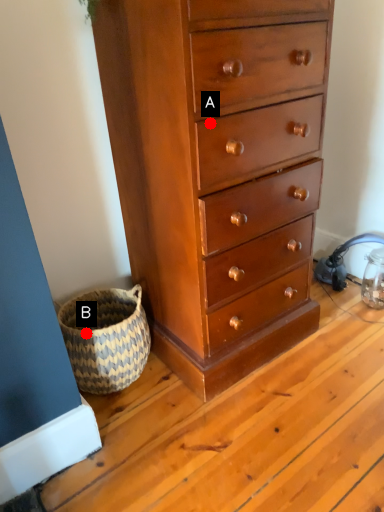
Question: Two points are circled on the image, labeled by A and B beside each circle. Among these points, which one is nearest to the camera?

Choices:
 (A) A is closer
 (B) B is closer

Answer: (A)